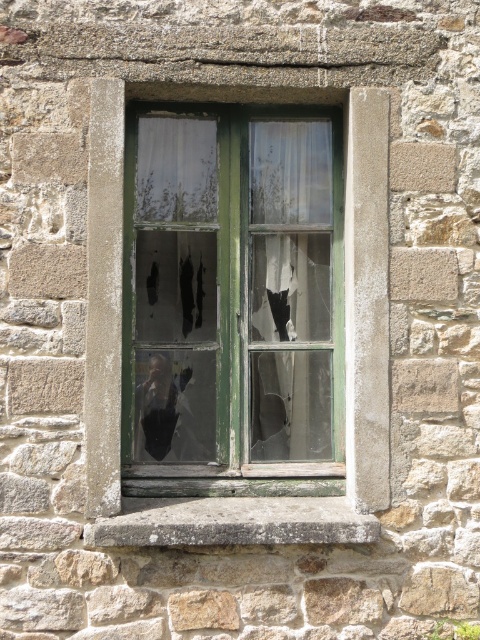
Which is in front, point (243, 152) or point (337, 540)?

Positioned in front is point (337, 540).

Measure the distance between green wooden window at center and gray concrete at center.

green wooden window at center and gray concrete at center are 16.40 inches apart.

Image resolution: width=480 pixels, height=640 pixels. What do you see at coordinates (232, 300) in the screenshot?
I see `green wooden window at center` at bounding box center [232, 300].

Find the location of a particular element. The image size is (480, 640). green wooden window at center is located at coordinates (232, 300).